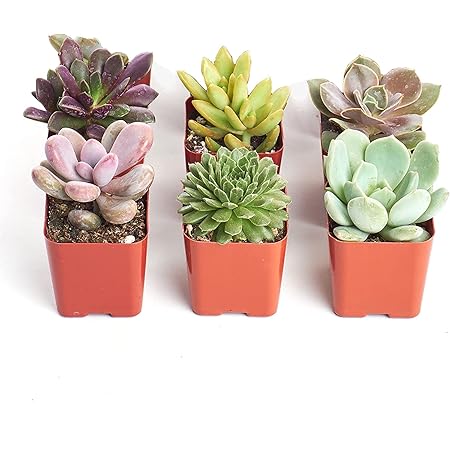
Find the location of a particular element. This screenshot has width=450, height=450. plant is located at coordinates (398, 195).